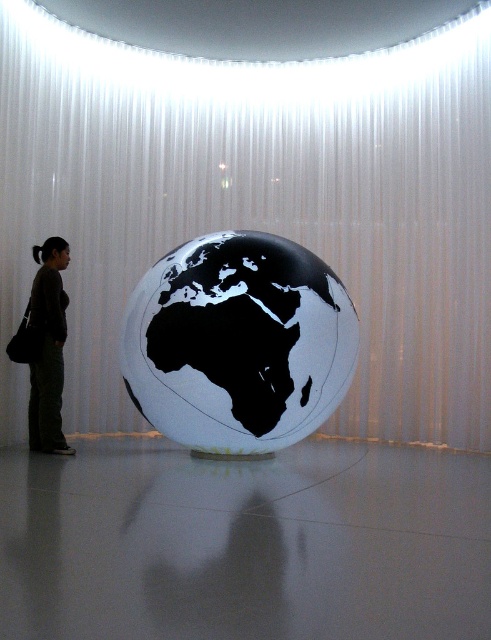
You are standing in the room and want to take a photo of the white glossy globe at center without the brown fabric pants at left appearing in the shot. How should you adjust your position?

Move your position so that the white glossy globe at center is no longer in the same line of sight as the brown fabric pants at left. Since the white glossy globe at center is above the brown fabric pants at left, you can lower your camera angle or move to a position where the globe is framed without the pants in view.

You are standing at point (x=44, y=257) and want to walk to the globe displayed in the center. Is the point (x=149, y=212) behind you or in front of you relative to your direction of movement?

Point (x=149, y=212) is behind point (x=44, y=257), so it is behind you relative to your direction of movement towards the globe.